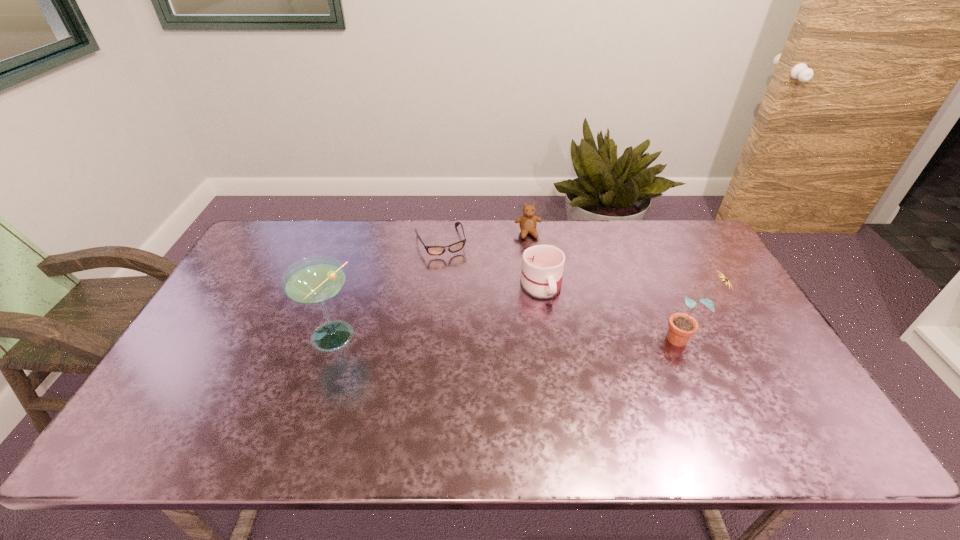
This screenshot has width=960, height=540. Find the location of `the leftmost object`. the leftmost object is located at coordinates (314, 280).

What are the coordinates of `the rightmost object` in the screenshot? It's located at (682, 326).

In order to click on mug in this screenshot , I will do `click(542, 269)`.

I want to click on teddy bear, so click(528, 222).

Where is `the second object from left to right`? The image size is (960, 540). the second object from left to right is located at coordinates (455, 247).

Locate an element on the screen. The height and width of the screenshot is (540, 960). spectacles is located at coordinates (455, 247).

This screenshot has height=540, width=960. I want to click on vacant space situated on the back of the martini, so click(356, 264).

The width and height of the screenshot is (960, 540). What are the coordinates of `free space located on the flower of the sunflower` in the screenshot? It's located at (627, 339).

At what (x,y) coordinates should I click in order to perform the action: click on vacant area situated 0.370m on the flower of the sunflower. Please return your answer as a coordinate pair (x, y). Image resolution: width=960 pixels, height=540 pixels. Looking at the image, I should click on coord(528,339).

Locate an element on the screen. This screenshot has height=540, width=960. free spot located on the flower of the sunflower is located at coordinates (532, 339).